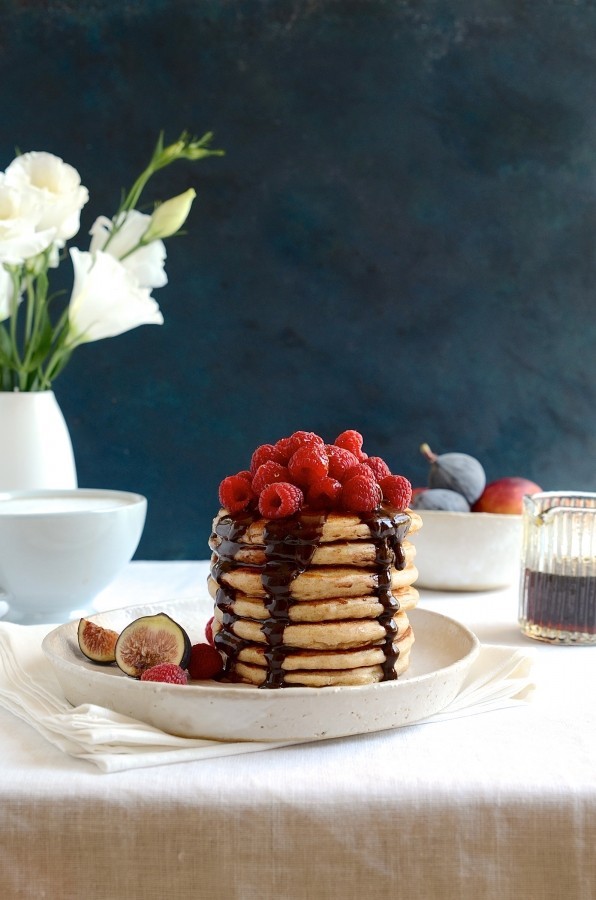
Find the location of a particular element. Image resolution: width=596 pixels, height=900 pixels. table cloth is located at coordinates (558, 708).